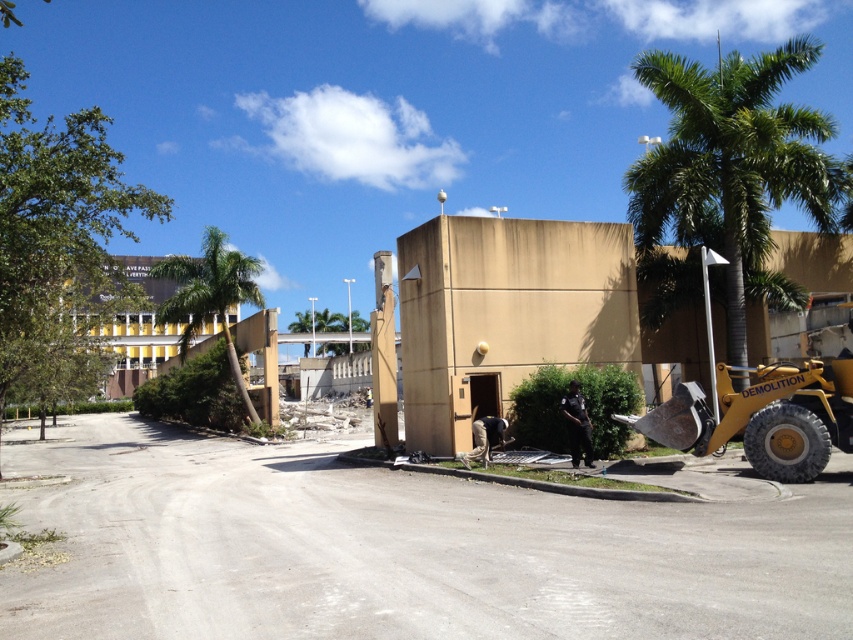
Question: Which point appears farthest from the camera in this image?

Choices:
 (A) (647, 419)
 (B) (183, 269)

Answer: (B)

Question: Does yellow rubber tire excavator at lower right have a lesser width compared to green leafy palm tree at left?

Choices:
 (A) no
 (B) yes

Answer: (B)

Question: Observing the image, what is the correct spatial positioning of yellow rubber tire excavator at lower right in reference to green leafy palm tree at left?

Choices:
 (A) above
 (B) below

Answer: (B)

Question: Which point is farther from the camera taking this photo?

Choices:
 (A) (254, 417)
 (B) (675, 60)

Answer: (A)

Question: Is yellow rubber tire excavator at lower right below green leafy palm tree at left?

Choices:
 (A) no
 (B) yes

Answer: (B)

Question: Which of the following is the closest to the observer?

Choices:
 (A) (228, 344)
 (B) (724, 417)
 (C) (817, 221)

Answer: (B)